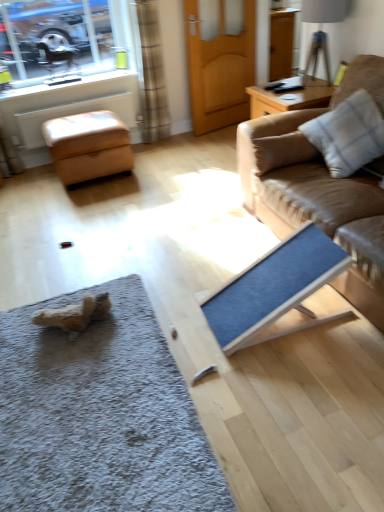
Where is `free point to the right of brown textured curtain at upper left`? free point to the right of brown textured curtain at upper left is located at coordinates (186, 138).